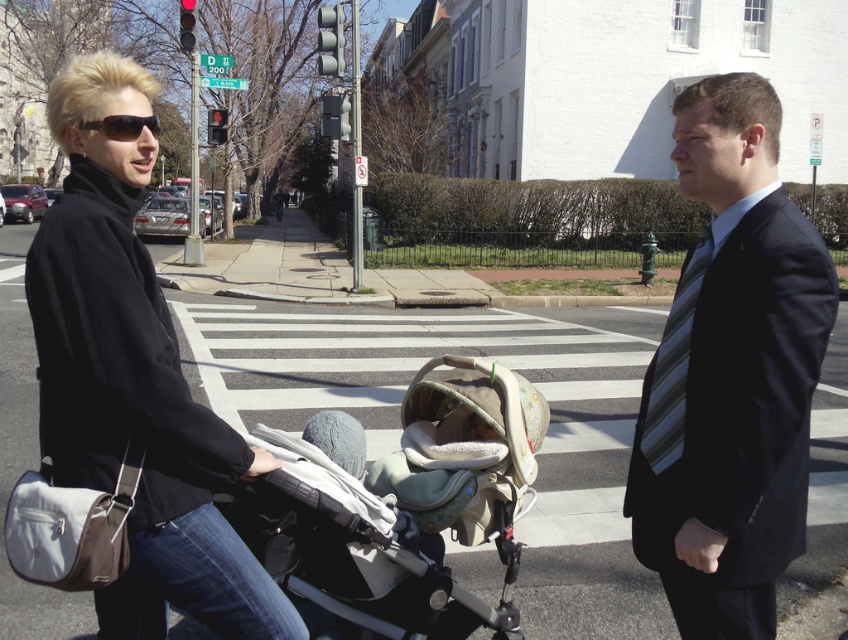
In the scene shown: You are standing at the pedestrian crossing and want to know which of the two points, point (x=514, y=417) or point (x=685, y=365), is closer to you. Based on the scene description, can you determine which point is nearer?

Point (x=514, y=417) is closer to you because it is further to the viewer than point (x=685, y=365).

You are a photographer standing at the pedestrian crossing. You want to capture a photo of the dark blue suit at center and the striped fabric tie at right. Which object should you focus on first if you want to ensure both are in focus?

The dark blue suit at center is much taller than the striped fabric tie at right, so you should focus on the dark blue suit at center first to ensure both are in focus.

Consider the image. You are standing at the pedestrian crossing in the image. Where is the dark blue suit at center located in terms of coordinates?

The dark blue suit at center is located at coordinates point [731,374].